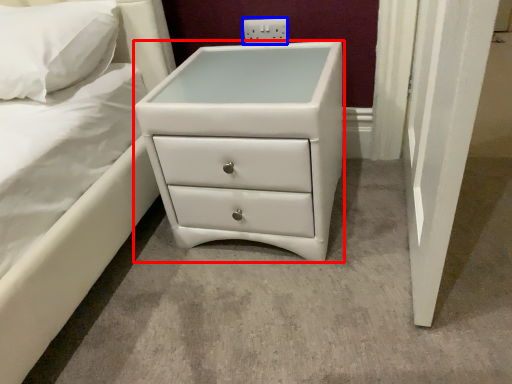
Question: Which object is further to the camera taking this photo, chest of drawers (highlighted by a red box) or electric outlet (highlighted by a blue box)?

Choices:
 (A) chest of drawers
 (B) electric outlet

Answer: (B)